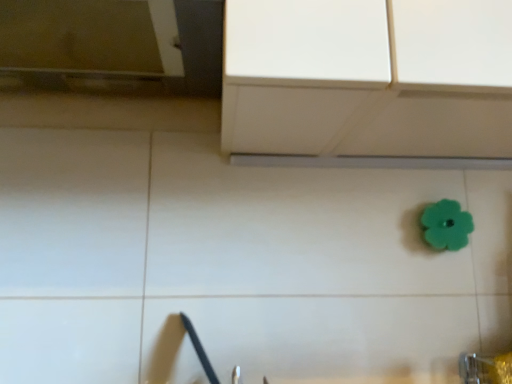
Question: Is teal rubber flower at center-right a part of metallic silver faucet at lower right?

Choices:
 (A) no
 (B) yes

Answer: (A)

Question: From the image's perspective, would you say metallic silver faucet at lower right is shown under teal rubber flower at center-right?

Choices:
 (A) yes
 (B) no

Answer: (A)

Question: Does metallic silver faucet at lower right appear on the left side of teal rubber flower at center-right?

Choices:
 (A) no
 (B) yes

Answer: (B)

Question: From a real-world perspective, is metallic silver faucet at lower right physically above teal rubber flower at center-right?

Choices:
 (A) yes
 (B) no

Answer: (B)

Question: From a real-world perspective, is metallic silver faucet at lower right below teal rubber flower at center-right?

Choices:
 (A) no
 (B) yes

Answer: (B)

Question: Can you confirm if metallic silver faucet at lower right is thinner than teal rubber flower at center-right?

Choices:
 (A) no
 (B) yes

Answer: (A)

Question: From a real-world perspective, is teal rubber flower at center-right positioned over metallic silver faucet at lower right based on gravity?

Choices:
 (A) no
 (B) yes

Answer: (B)

Question: Considering the relative sizes of teal rubber flower at center-right and metallic silver faucet at lower right in the image provided, is teal rubber flower at center-right smaller than metallic silver faucet at lower right?

Choices:
 (A) no
 (B) yes

Answer: (B)

Question: Is teal rubber flower at center-right with metallic silver faucet at lower right?

Choices:
 (A) yes
 (B) no

Answer: (B)

Question: Can you confirm if teal rubber flower at center-right is bigger than metallic silver faucet at lower right?

Choices:
 (A) yes
 (B) no

Answer: (B)

Question: Is teal rubber flower at center-right not inside metallic silver faucet at lower right?

Choices:
 (A) no
 (B) yes

Answer: (B)

Question: Considering the relative sizes of teal rubber flower at center-right and metallic silver faucet at lower right in the image provided, is teal rubber flower at center-right thinner than metallic silver faucet at lower right?

Choices:
 (A) yes
 (B) no

Answer: (A)

Question: Would you say metallic silver faucet at lower right is inside or outside teal rubber flower at center-right?

Choices:
 (A) outside
 (B) inside

Answer: (A)